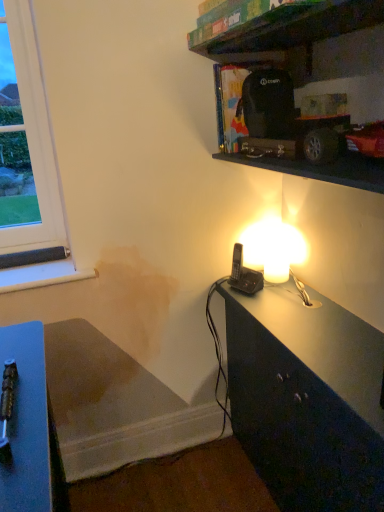
Find the location of a particular element. wooden bookshelf at upper center is located at coordinates (288, 30).

The width and height of the screenshot is (384, 512). Describe the element at coordinates (288, 30) in the screenshot. I see `wooden bookshelf at upper center` at that location.

Describe the element at coordinates (244, 274) in the screenshot. This screenshot has width=384, height=512. I see `black plastic phone at right` at that location.

This screenshot has height=512, width=384. In order to click on black plastic phone at right in this screenshot , I will do (244, 274).

Identify the location of wooden bookshelf at upper center. Image resolution: width=384 pixels, height=512 pixels. (288, 30).

Would you say wooden bookshelf at upper center is to the left or to the right of black plastic phone at right in the picture?

wooden bookshelf at upper center is to the right of black plastic phone at right.

Is the depth of wooden bookshelf at upper center less than that of black plastic phone at right?

That is True.

Is point (243, 23) positioned after point (254, 279)?

No, it is in front of (254, 279).

From the image's perspective, is wooden bookshelf at upper center above or below black plastic phone at right?

Based on their image positions, wooden bookshelf at upper center is located above black plastic phone at right.

From a real-world perspective, is wooden bookshelf at upper center on top of black plastic phone at right?

Yes, from a real-world perspective, wooden bookshelf at upper center is above black plastic phone at right.

Is wooden bookshelf at upper center wider or thinner than black plastic phone at right?

Clearly, wooden bookshelf at upper center has more width compared to black plastic phone at right.

Who is shorter, wooden bookshelf at upper center or black plastic phone at right?

Standing shorter between the two is wooden bookshelf at upper center.

Is wooden bookshelf at upper center bigger or smaller than black plastic phone at right?

wooden bookshelf at upper center is bigger than black plastic phone at right.

Is black plastic phone at right a part of wooden bookshelf at upper center?

No, black plastic phone at right is not inside wooden bookshelf at upper center.

Is wooden bookshelf at upper center not close to black plastic phone at right?

No, wooden bookshelf at upper center is not far from black plastic phone at right.

Is wooden bookshelf at upper center facing towards black plastic phone at right?

No, wooden bookshelf at upper center is not oriented towards black plastic phone at right.

Can you tell me how much wooden bookshelf at upper center and black plastic phone at right differ in facing direction?

The angle between the facing direction of wooden bookshelf at upper center and the facing direction of black plastic phone at right is 21.4 degrees.

Locate an element on the screen. This screenshot has height=512, width=384. shelf in front of the black plastic phone at right is located at coordinates (288, 30).

Visually, is black plastic phone at right positioned to the left or to the right of wooden bookshelf at upper center?

From the image, it's evident that black plastic phone at right is to the left of wooden bookshelf at upper center.

Considering their positions, is black plastic phone at right located in front of or behind wooden bookshelf at upper center?

In the image, black plastic phone at right appears behind wooden bookshelf at upper center.

Does point (235, 269) come in front of point (241, 27)?

That is False.

From the image's perspective, does black plastic phone at right appear higher than wooden bookshelf at upper center?

No, from the image's perspective, black plastic phone at right is not on top of wooden bookshelf at upper center.

Looking at this image, from a real-world perspective, is black plastic phone at right positioned over wooden bookshelf at upper center based on gravity?

Incorrect, from a real-world perspective, black plastic phone at right is lower than wooden bookshelf at upper center.

Consider the image. Considering the relative sizes of black plastic phone at right and wooden bookshelf at upper center in the image provided, is black plastic phone at right wider than wooden bookshelf at upper center?

No.

Can you confirm if black plastic phone at right is shorter than wooden bookshelf at upper center?

No, black plastic phone at right is not shorter than wooden bookshelf at upper center.

From the picture: Which of these two, black plastic phone at right or wooden bookshelf at upper center, is smaller?

black plastic phone at right is smaller.

Can we say black plastic phone at right lies outside wooden bookshelf at upper center?

black plastic phone at right lies outside wooden bookshelf at upper center's area.

Is black plastic phone at right touching wooden bookshelf at upper center?

black plastic phone at right and wooden bookshelf at upper center are clearly separated.

From the picture: Is black plastic phone at right oriented away from wooden bookshelf at upper center?

No, wooden bookshelf at upper center is not at the back of black plastic phone at right.

Identify the location of shelf lying on the right of black plastic phone at right. (288, 30).

What are the coordinates of `equipment located underneath the wooden bookshelf at upper center (from a real-world perspective)` in the screenshot? It's located at (244, 274).

Locate an element on the screen. shelf located in front of the black plastic phone at right is located at coordinates click(288, 30).